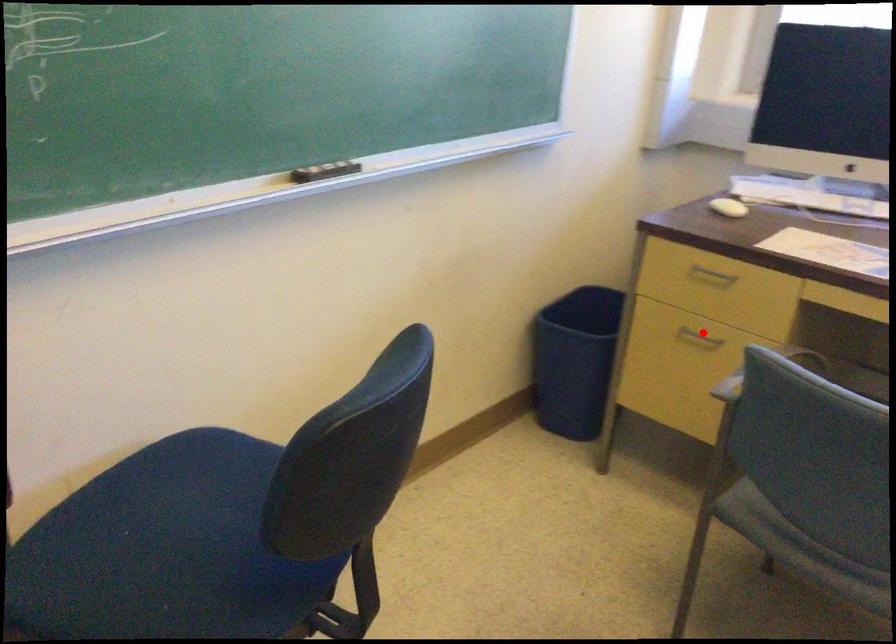
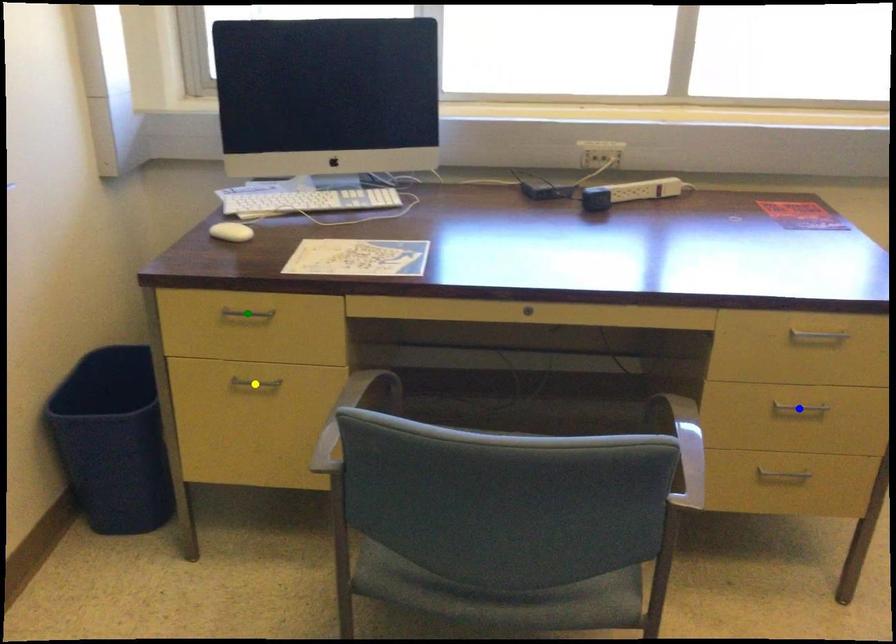
Question: I am providing you with two images of the same scene from different viewpoints. A red point is marked on the first image. You are given multiple points on the second image. Which point in image 2 is actually the same real-world point as the red point in image 1?

Choices:
 (A) green point
 (B) yellow point
 (C) blue point

Answer: (B)